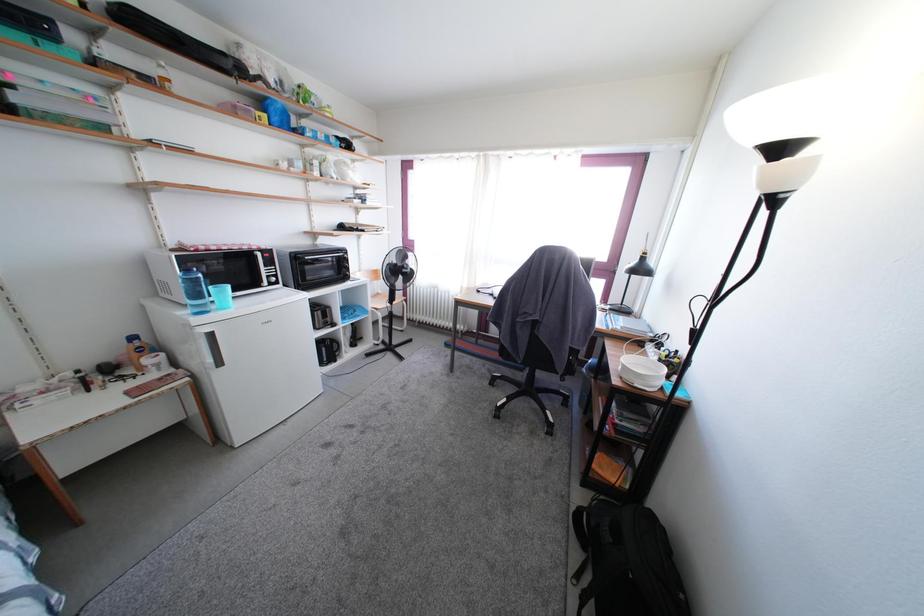
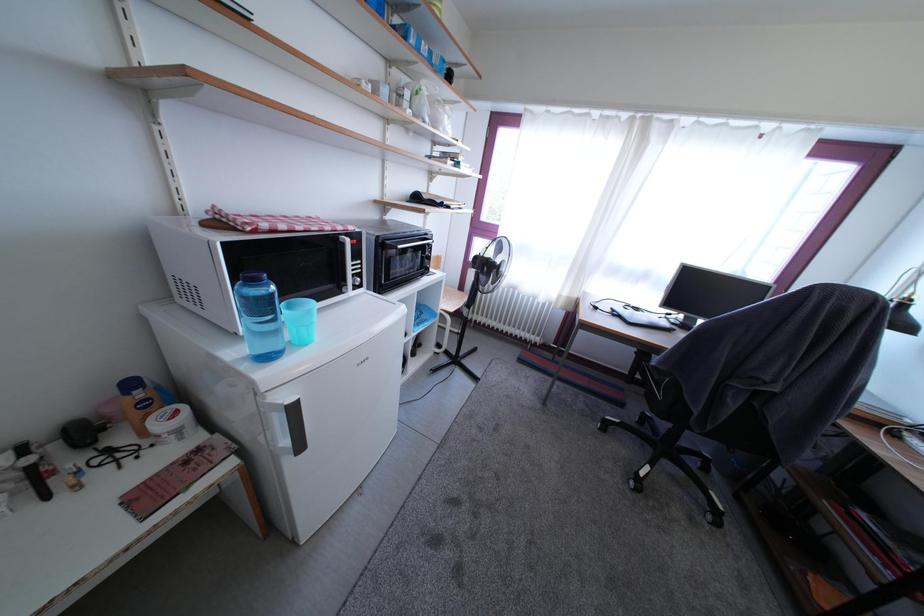
Which direction would the cameraman need to move to produce the second image?

The cameraman walked toward left, forward.